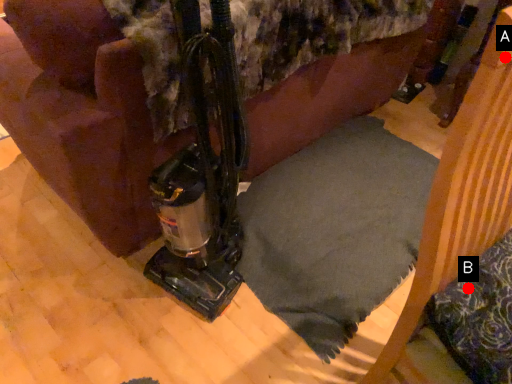
Question: Two points are circled on the image, labeled by A and B beside each circle. Which point is farther to the camera?

Choices:
 (A) A is further
 (B) B is further

Answer: (B)